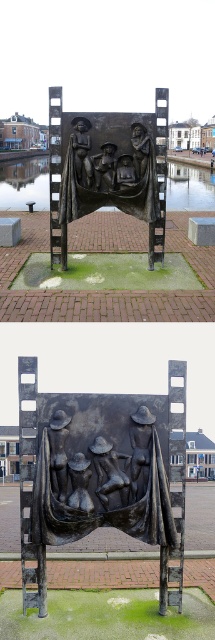
You are an art student analyzing the sculpture from the top view. You notice the bronze textured figures at center and the bronze textured sculpture at center. Which one is located to the left?

The bronze textured figures at center are positioned on the left side of the bronze textured sculpture at center.

Based on the scene description, where exactly are the bronze textured figures at center located in terms of coordinates?

The bronze textured figures at center are located at point coordinates of (101, 467).

Looking at this image, you are standing in a public square and want to take a photo of the bronze textured sculpture at center. If you are currently 5 meters away from it, can you move closer to get a better shot?

The bronze textured sculpture at center is 5.35 meters from camera. Since you are currently 5 meters away, you can move closer to get a better shot as you are already within the distance specified.